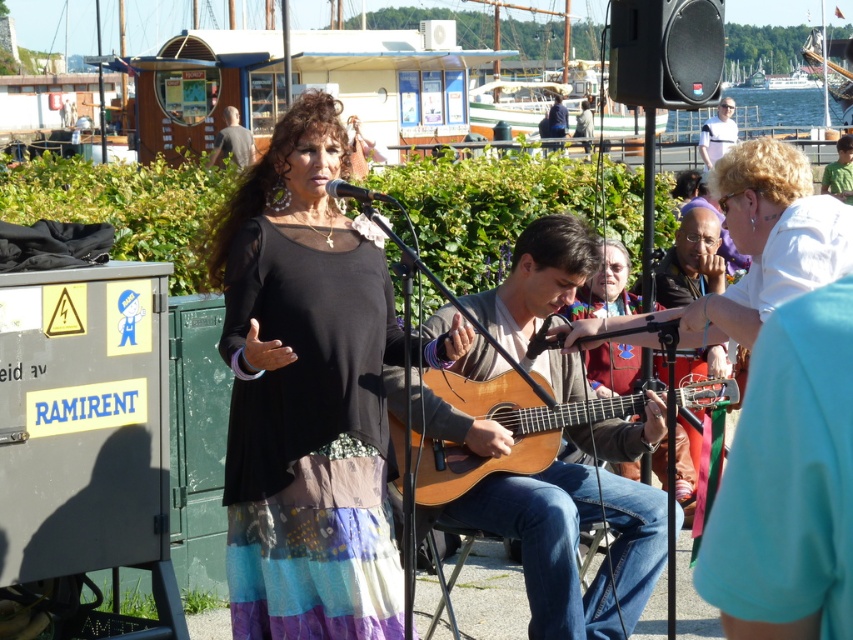
Question: Estimate the real-world distances between objects in this image. Which object is closer to the black sheer top at center?

Choices:
 (A) wooden acoustic guitar at center
 (B) clear water at upper right

Answer: (A)

Question: Does black sheer top at center lie behind green fabric shirt at right?

Choices:
 (A) no
 (B) yes

Answer: (A)

Question: Is light brown wood guitar at center behind green fabric shirt at right?

Choices:
 (A) yes
 (B) no

Answer: (B)

Question: Is clear water at upper right positioned in front of white cotton shirt at upper right?

Choices:
 (A) yes
 (B) no

Answer: (A)

Question: Which object is the closest to the clear water at upper right?

Choices:
 (A) gray fabric shirt at upper center
 (B) white cotton shirt at upper right

Answer: (B)

Question: Which of the following is the closest to the observer?

Choices:
 (A) (830, 163)
 (B) (727, 116)

Answer: (A)